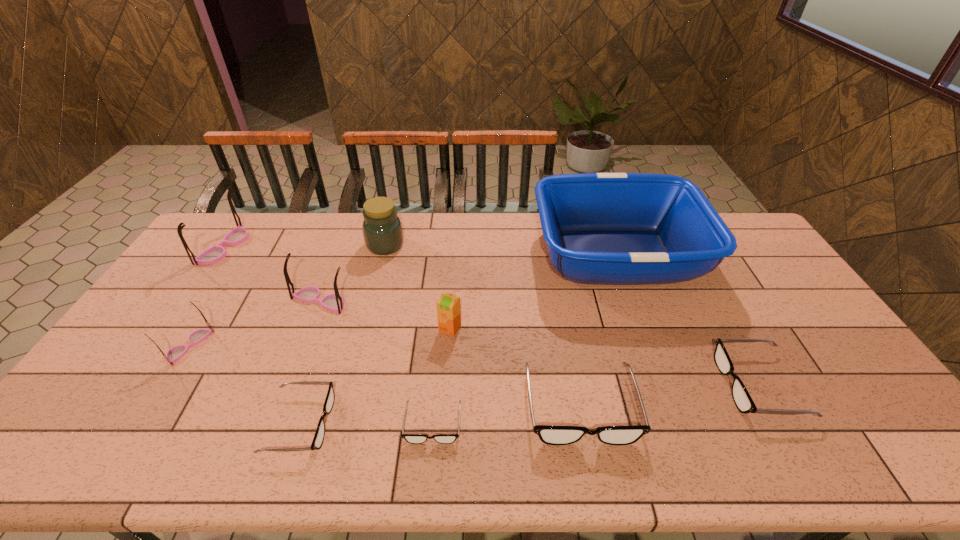
Find the location of `the fourth shortest object`. the fourth shortest object is located at coordinates (552, 435).

At what (x,y) coordinates should I click in order to perform the action: click on the third shortest object. Please return your answer as a coordinate pair (x, y). The height and width of the screenshot is (540, 960). Looking at the image, I should click on (742, 399).

At what (x,y) coordinates should I click in order to perform the action: click on the third shortest spectacles. Please return your answer as a coordinate pair (x, y). The width and height of the screenshot is (960, 540). Looking at the image, I should click on (742, 399).

At what (x,y) coordinates should I click in order to perform the action: click on the ninth tallest object. Please return your answer as a coordinate pair (x, y). Looking at the image, I should click on (318, 439).

The image size is (960, 540). In order to click on the leftmost black spectacles in this screenshot , I will do `click(318, 439)`.

At what (x,y) coordinates should I click in order to perform the action: click on the fifth spectacles from left to right. Please return your answer as a coordinate pair (x, y). The height and width of the screenshot is (540, 960). Looking at the image, I should click on (410, 438).

Locate an element on the screen. The height and width of the screenshot is (540, 960). the smallest black spectacles is located at coordinates (410, 438).

Where is `vacant space located on the front of the tray`? vacant space located on the front of the tray is located at coordinates (660, 378).

At what (x,y) coordinates should I click in order to perform the action: click on vacant area situated on the front of the tallest spectacles. Please return your answer as a coordinate pair (x, y). Looking at the image, I should click on (196, 287).

Locate an element on the screen. The width and height of the screenshot is (960, 540). free space located 0.240m on the right of the jar is located at coordinates [470, 245].